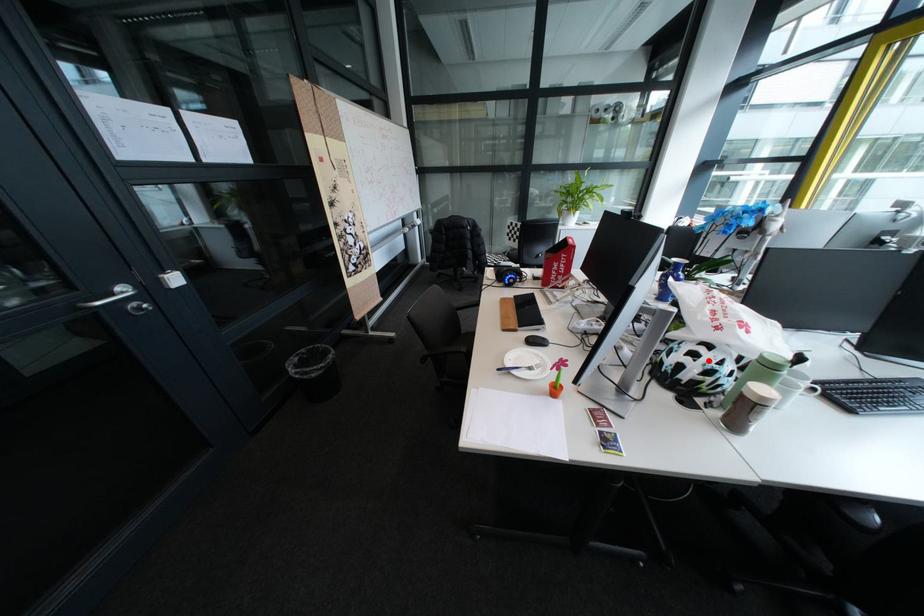
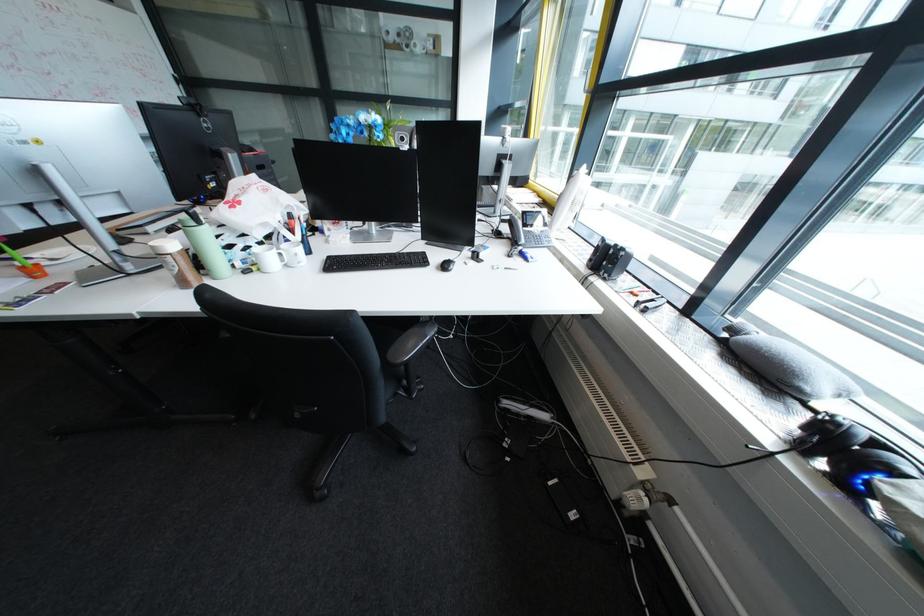
Question: I am providing you with two images of the same scene from different viewpoints. A red point is marked on the first image. At the location where the point appears in image 1, is it still visible in image 2?

Choices:
 (A) Yes
 (B) No

Answer: (B)